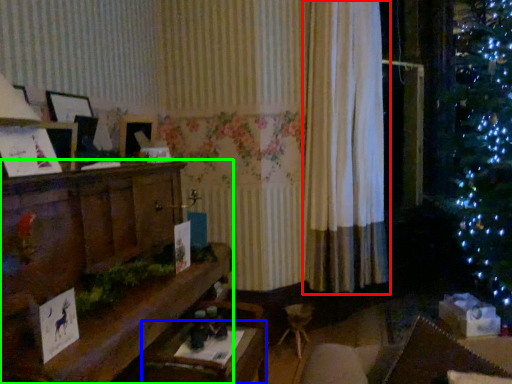
Question: Which object is the farthest from curtain (highlighted by a red box)? Choose among these: table (highlighted by a blue box) or furniture (highlighted by a green box).

Choices:
 (A) table
 (B) furniture

Answer: (A)